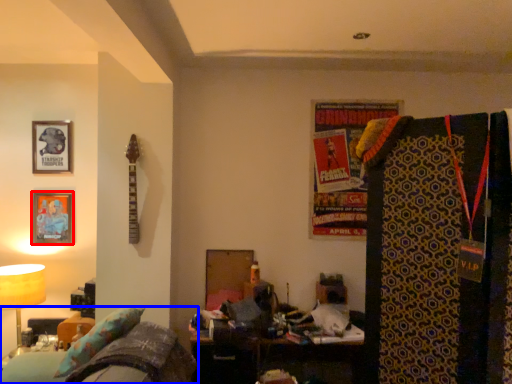
Question: Among these objects, which one is nearest to the camera, picture frame (highlighted by a red box) or furniture (highlighted by a blue box)?

Choices:
 (A) picture frame
 (B) furniture

Answer: (B)